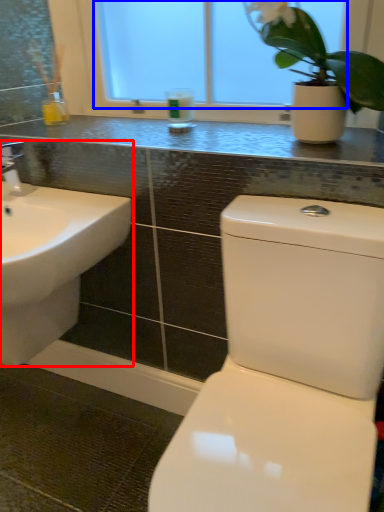
Question: Which object appears closest to the camera in this image, sink (highlighted by a red box) or window screen (highlighted by a blue box)?

Choices:
 (A) sink
 (B) window screen

Answer: (A)